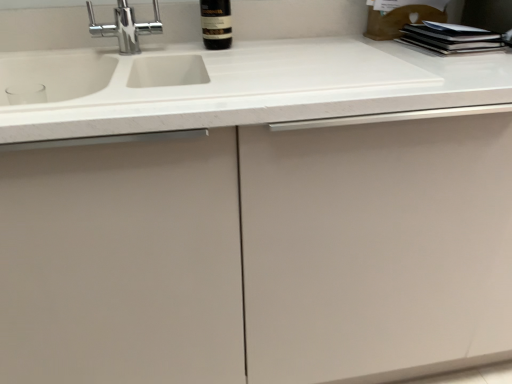
Locate an element on the screen. vacant area that is in front of dark glass bottle at upper center is located at coordinates (252, 52).